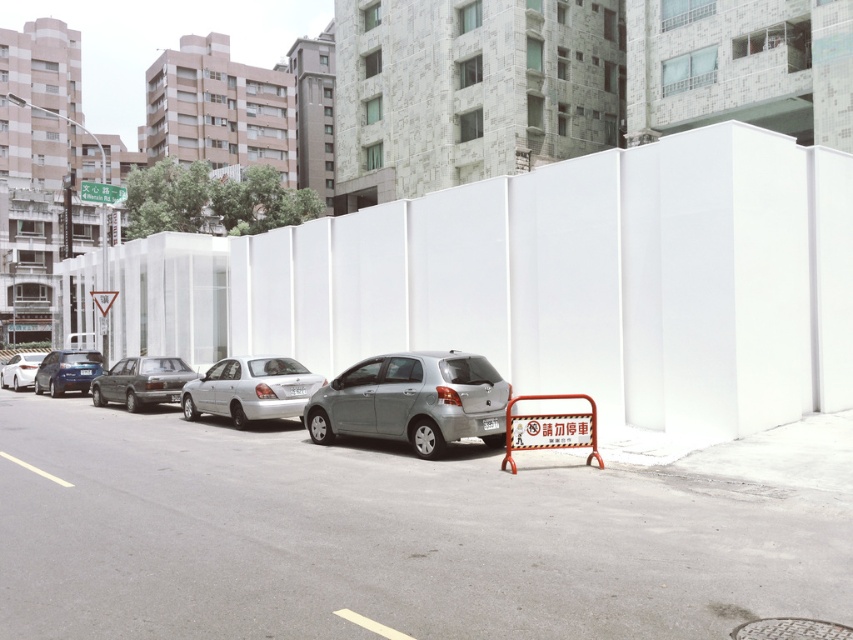
Does matte gray sedan at center have a greater width compared to orange metallic barricade at lower center?

Indeed, matte gray sedan at center has a greater width compared to orange metallic barricade at lower center.

Who is higher up, matte gray sedan at center or orange metallic barricade at lower center?

matte gray sedan at center is above.

Who is more distant from viewer, (120,365) or (601,461)?

Point (120,365)

The width and height of the screenshot is (853, 640). I want to click on matte gray sedan at center, so click(141, 381).

From the picture: Does white plastic barrier at center come behind matte gray sedan at center?

No, white plastic barrier at center is in front of matte gray sedan at center.

Is point (154, 346) farther from viewer compared to point (117, 401)?

Yes, it is.

The image size is (853, 640). Identify the location of white plastic barrier at center. (553, 282).

This screenshot has height=640, width=853. What do you see at coordinates (67, 371) in the screenshot?
I see `matte blue hatchback at left` at bounding box center [67, 371].

From the picture: Is matte blue hatchback at left positioned at the back of green plastic sign at upper left?

No.

Describe the element at coordinates (67, 371) in the screenshot. I see `matte blue hatchback at left` at that location.

The height and width of the screenshot is (640, 853). In order to click on matte blue hatchback at left in this screenshot , I will do `click(67, 371)`.